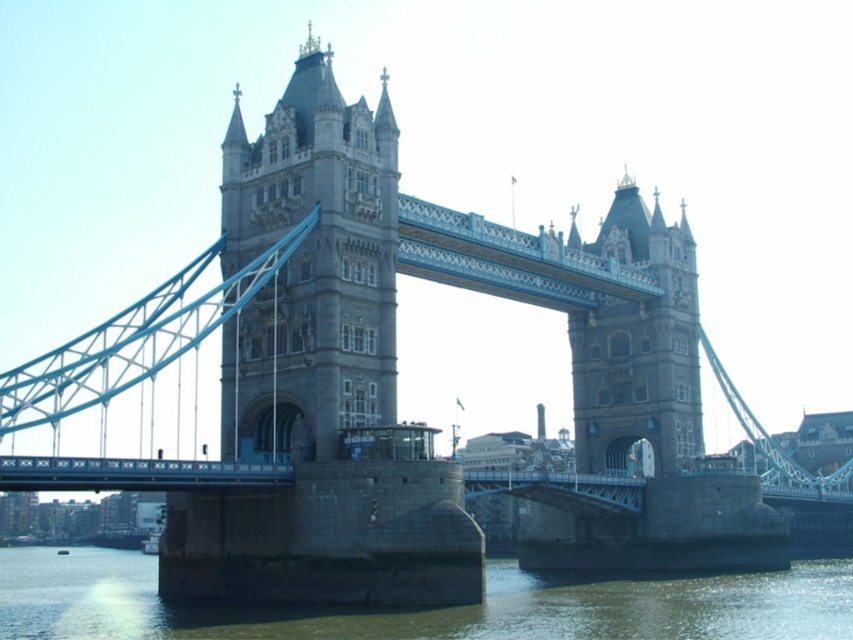
You are an architect analyzing the structural integrity of the Tower Bridge. You observe the gray stone tower at center and the stone stonework tower at center. Which tower has a greater width according to the provided information?

The gray stone tower at center might be wider than the stone stonework tower at center, so the gray stone tower at center likely has a greater width.

You are standing on the Thames River walkway and notice the greenish concrete river at lower center and the stone stonework tower at center. Which object is positioned lower in the scene?

The greenish concrete river at lower center is located below the stone stonework tower at center, so it is positioned lower in the scene.

In the scene shown: You are standing at the coordinates point 0.419, 0.365. There is a gray stone tower at center. Is the tower directly in front of you?

The gray stone tower at center is located at point (x=310, y=268), so yes, the tower is directly in front of you at those coordinates.